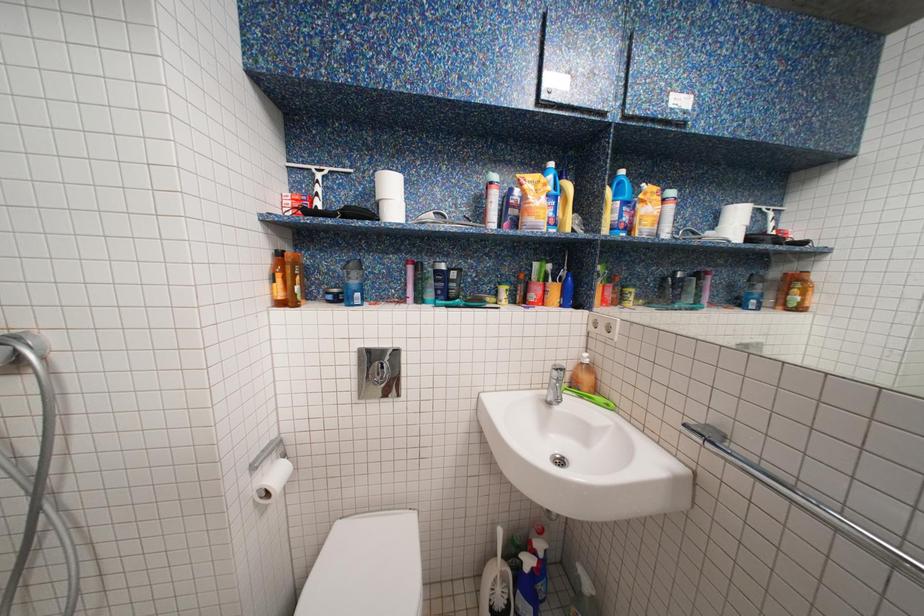
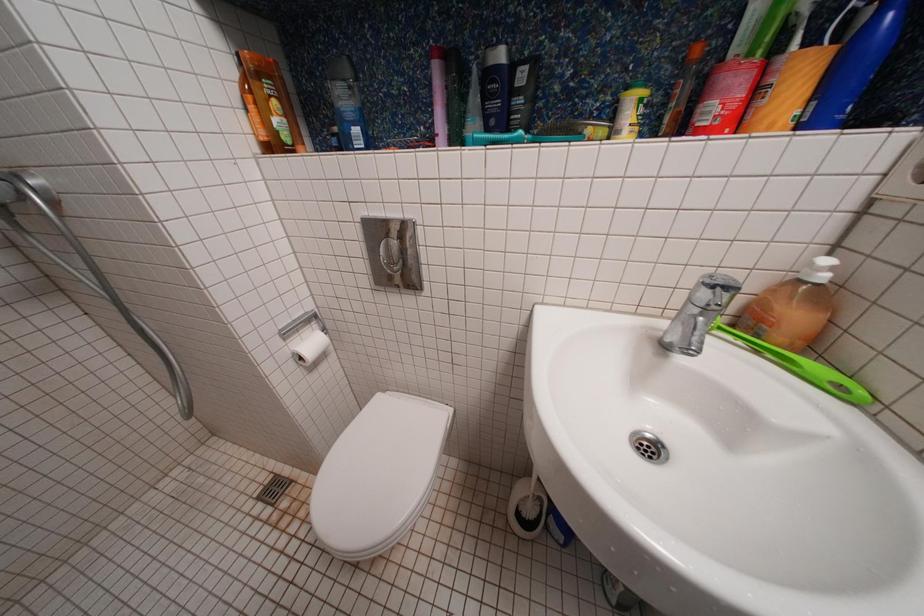
Based on the continuous images, in which direction is the camera rotating?

The camera's rotation is toward left-down.